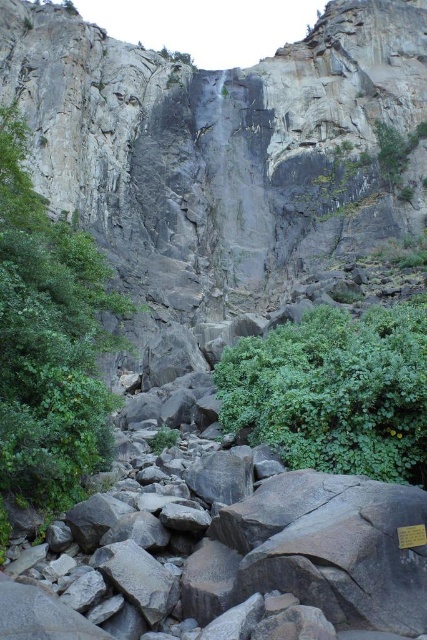
From the picture: You are a hiker trying to navigate through the rocky terrain in the image. You notice two green leafy shrubs at center and a green leafy bush at lower center. Which one is positioned to the left of the other?

The green leafy shrubs at center are to the left of the green leafy bush at lower center.

You are a hiker planning to cross the rugged landscape between the green leafy shrubs at center and the green leafy bush at lower center. The path is narrow and rocky. If your backpack has a width of 2 feet, can you safely navigate the path between them?

The distance between the green leafy shrubs at center and the green leafy bush at lower center is 78.20 feet. Since the path is narrow but the distance is significantly larger than your backpack width of 2 feet, you can safely navigate the path between them.

You are standing at the base of the rock face in the image and want to reach the point marked as point (61, 284). If you have a rope that is 70 meters long, will it be sufficient to reach that point?

The distance between you and point (61, 284) is 73.29 meters, which is longer than the 70 meter rope you have. Therefore, the rope is not long enough to reach the point.